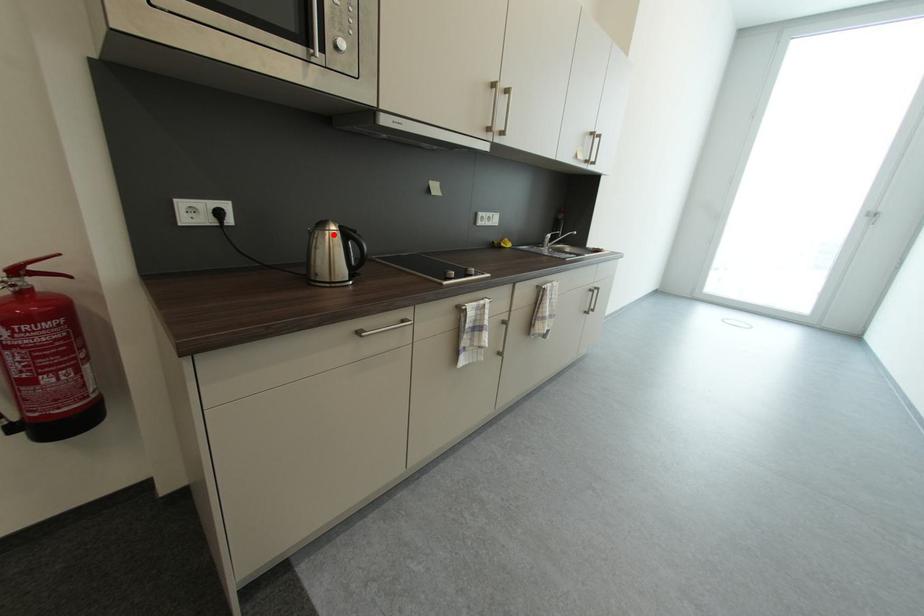
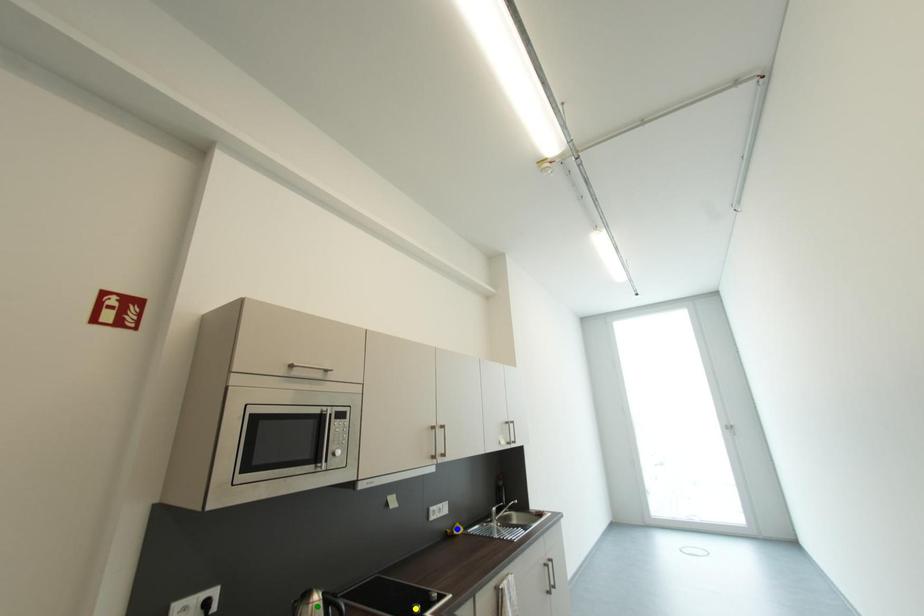
Question: I am providing you with two images of the same scene from different viewpoints. A red point is marked on the first image. You are given multiple points on the second image. Which point in image 2 is actually the same real-world point as the red point in image 1?

Choices:
 (A) green point
 (B) yellow point
 (C) blue point

Answer: (A)